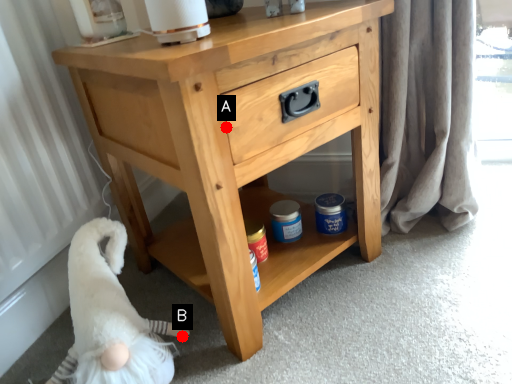
Question: Two points are circled on the image, labeled by A and B beside each circle. Which point is closer to the camera taking this photo?

Choices:
 (A) A is closer
 (B) B is closer

Answer: (A)